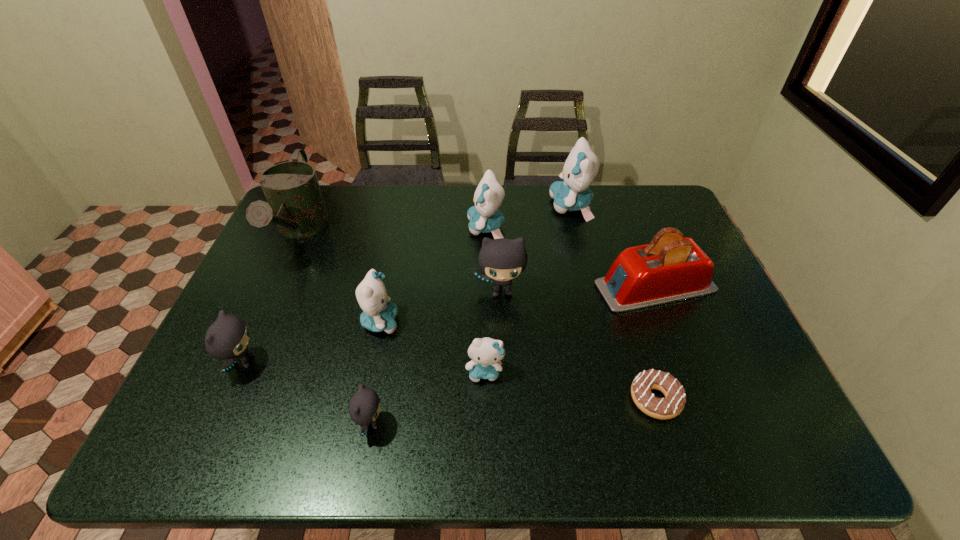
This screenshot has width=960, height=540. Find the location of `blank space located 0.390m on the face of the second biggest blue kitten`. blank space located 0.390m on the face of the second biggest blue kitten is located at coordinates (347, 228).

In order to click on vacant region located on the face of the second biggest blue kitten in this screenshot , I will do tap(445, 228).

Locate an element on the screen. This screenshot has width=960, height=540. vacant space located on the face of the second biggest blue kitten is located at coordinates (372, 228).

This screenshot has width=960, height=540. I want to click on free region located 0.180m on the front of the red toaster, so click(687, 372).

Locate an element on the screen. The image size is (960, 540). vacant area situated 0.070m on the front-facing side of the biggest gray kitten is located at coordinates (503, 325).

Identify the location of vacant space located 0.180m on the face of the second nearest blue kitten. This screenshot has height=540, width=960. (468, 322).

The width and height of the screenshot is (960, 540). What are the coordinates of `vacant space situated 0.380m on the front-facing side of the leftmost kitten` in the screenshot? It's located at (417, 362).

You are a GUI agent. You are given a task and a screenshot of the screen. Output one action in this format:
    pyautogui.click(x=<x>, y=<y>)
    Task: Click on the vacant space situated on the face of the nearest blue kitten
    
    Given the screenshot: What is the action you would take?
    pyautogui.click(x=486, y=413)

The image size is (960, 540). Identify the location of vacant area located on the front-facing side of the second gray kitten from left to right. (505, 423).

Identify the location of blank space located 0.380m on the left of the shortest object. (462, 399).